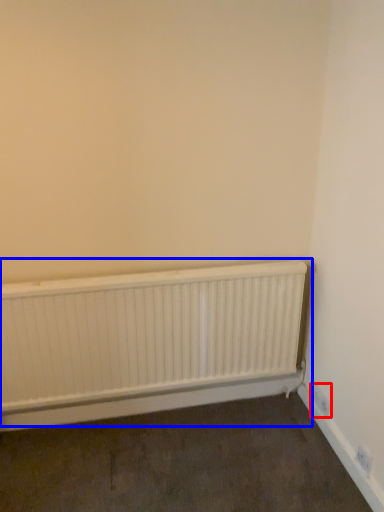
Question: Among these objects, which one is nearest to the camera, electric outlet (highlighted by a red box) or radiator (highlighted by a blue box)?

Choices:
 (A) electric outlet
 (B) radiator

Answer: (B)